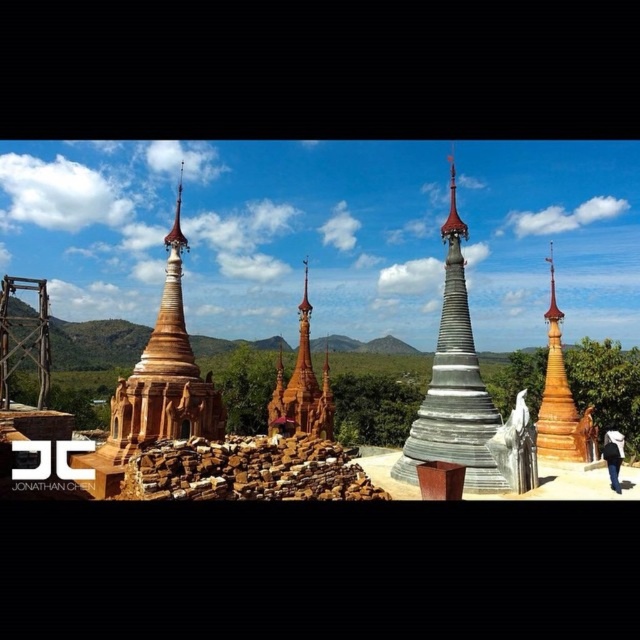
You are standing at the center of the scene and want to locate the matte brown pagoda at left. Based on the coordinates provided, in which general direction should you look to find it?

The matte brown pagoda at left is located at coordinates point (157, 387), which means it is positioned to the upper right direction from your current position at the center of the scene.

You are a tourist visiting the pagodas and want to take a photo that includes both the golden polished wood tower at right and the wooden temple at center. Which one should you focus on to ensure both are in frame without needing to zoom in or out?

You should focus on the wooden temple at center because the golden polished wood tower at right is taller than it, so keeping the temple in the center will allow both structures to fit within the camera frame without needing to adjust zoom.